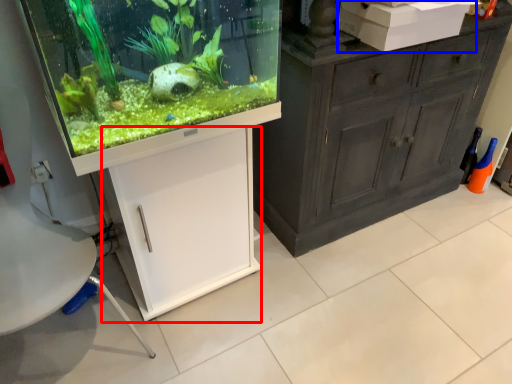
Question: Which point is further to the camera, cabinetry (highlighted by a red box) or box (highlighted by a blue box)?

Choices:
 (A) cabinetry
 (B) box

Answer: (B)